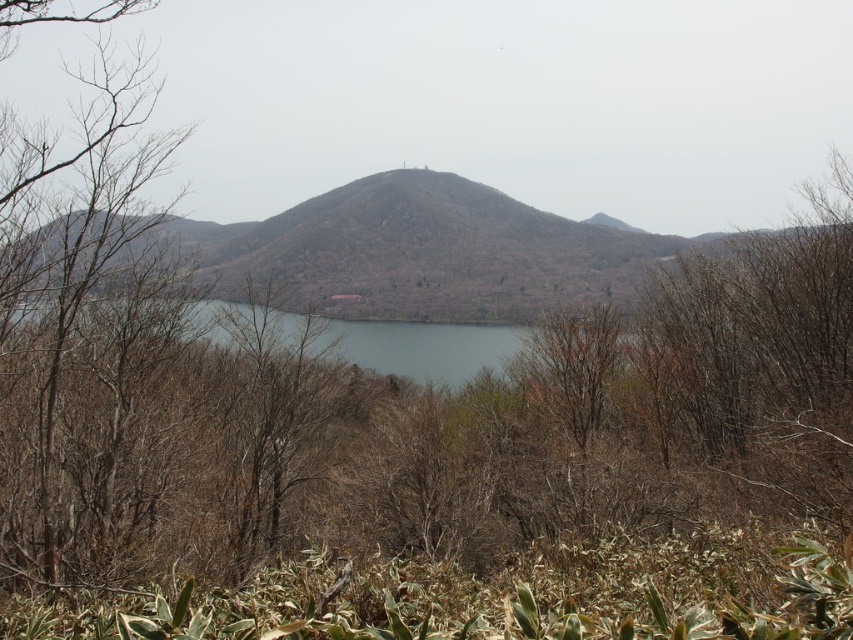
Question: Is brown textured hill at center further to the viewer compared to clear water at center?

Choices:
 (A) yes
 (B) no

Answer: (B)

Question: Is brown textured hill at center below clear water at center?

Choices:
 (A) yes
 (B) no

Answer: (B)

Question: Can you confirm if brown textured hill at center is positioned to the left of clear water at center?

Choices:
 (A) no
 (B) yes

Answer: (A)

Question: Which object appears farthest from the camera in this image?

Choices:
 (A) clear water at center
 (B) brown textured hill at center

Answer: (A)